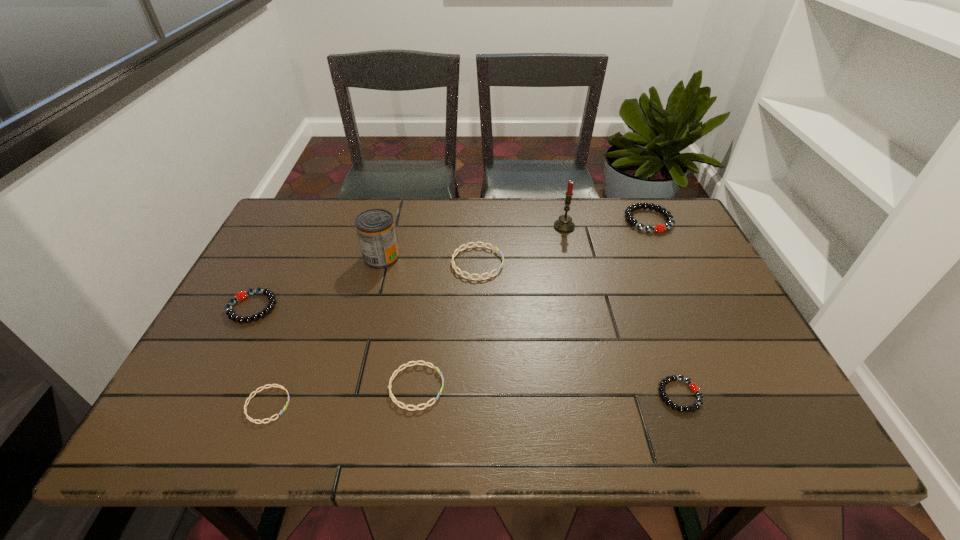
The height and width of the screenshot is (540, 960). Find the location of `vacant space that is in between the shortest object and the biggest black bracelet`. vacant space that is in between the shortest object and the biggest black bracelet is located at coordinates (458, 313).

The height and width of the screenshot is (540, 960). I want to click on empty space that is in between the red can and the red candle, so click(x=473, y=242).

The height and width of the screenshot is (540, 960). In order to click on free space that is in between the tallest object and the third tallest object in this screenshot , I will do `click(606, 224)`.

Identify the location of object that is the sixth closest to the fifth nearest bracelet. click(696, 406).

Point out which object is positioned as the fourth nearest to the can. Please provide its 2D coordinates. Your answer should be formatted as a tuple, i.e. [(x, y)], where the tuple contains the x and y coordinates of a point satisfying the conditions above.

[(271, 385)]

Locate which bracelet is the third closest to the smallest black bracelet. Please provide its 2D coordinates. Your answer should be formatted as a tuple, i.e. [(x, y)], where the tuple contains the x and y coordinates of a point satisfying the conditions above.

[(630, 219)]

Identify the location of bracelet that is the second closest to the second biggest blue bracelet. This screenshot has width=960, height=540. (454, 266).

Locate an element on the screen. black bracelet that can be found as the second closest to the red can is located at coordinates (630, 219).

Identify the location of black bracelet that can be found as the closest to the farthest black bracelet. (696, 406).

In order to click on blue bracelet that stands as the second closest to the red candle in this screenshot , I will do `click(394, 400)`.